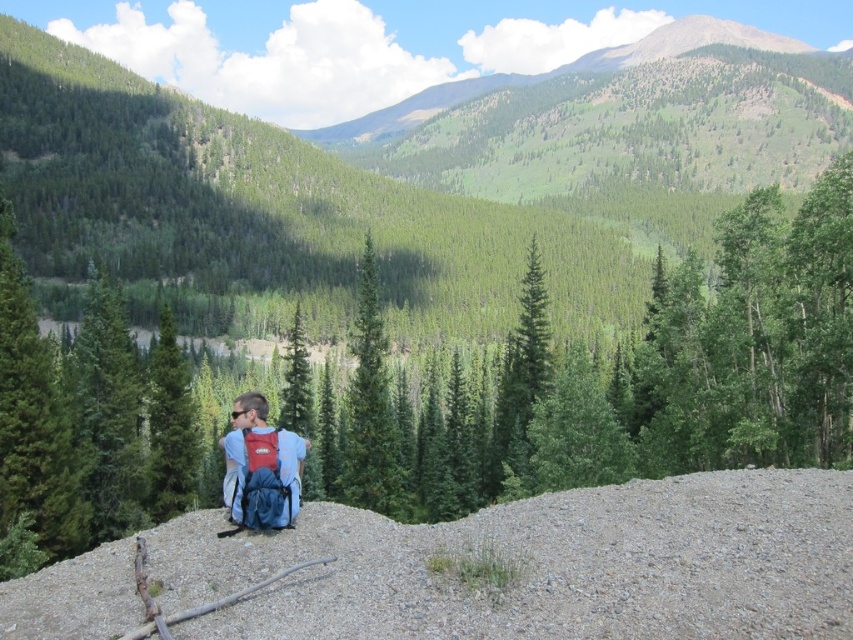
Can you confirm if green matte tree at center is shorter than matte blue backpack at center?

No, green matte tree at center is not shorter than matte blue backpack at center.

In the scene shown: Who is positioned more to the left, green matte tree at center or matte blue backpack at center?

green matte tree at center is more to the left.

Locate an element on the screen. This screenshot has height=640, width=853. green matte tree at center is located at coordinates (370, 410).

Image resolution: width=853 pixels, height=640 pixels. Identify the location of green matte tree at center. (370, 410).

Does green textured tree at center have a greater height compared to matte blue backpack at center?

Yes.

Which of these two, green textured tree at center or matte blue backpack at center, stands shorter?

matte blue backpack at center is shorter.

Is point (405, 445) positioned in front of point (280, 500)?

That is False.

Where is `green textured tree at center`? The height and width of the screenshot is (640, 853). green textured tree at center is located at coordinates coord(602,378).

Who is positioned more to the left, green textured tree at center or green matte tree at center?

green matte tree at center is more to the left.

Between green textured tree at center and green matte tree at center, which one is positioned lower?

green textured tree at center

I want to click on green textured tree at center, so click(602, 378).

Where is `green textured tree at center`? green textured tree at center is located at coordinates (602, 378).